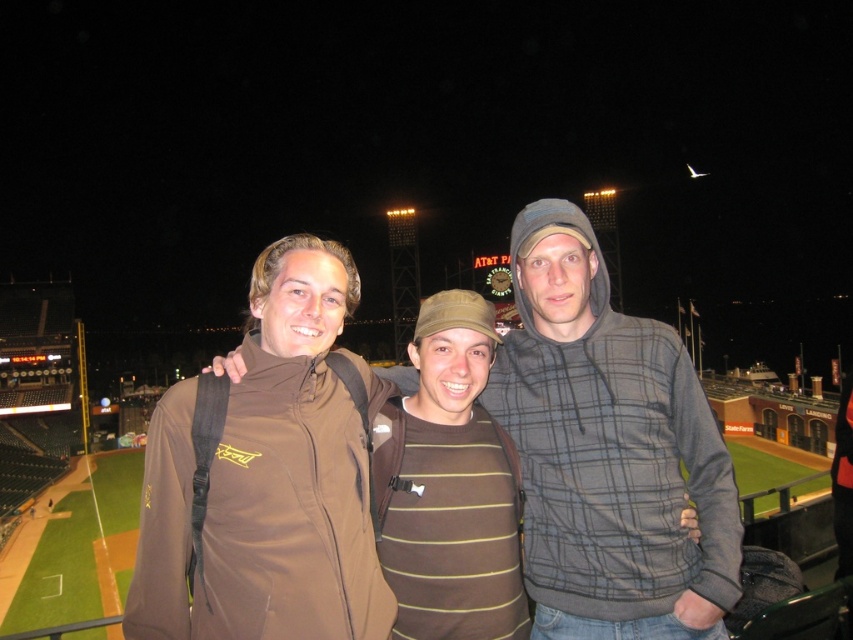
Question: Can you confirm if brown fabric jacket at center is bigger than gray plaid hoodie at center?

Choices:
 (A) yes
 (B) no

Answer: (A)

Question: Is brown fabric jacket at center smaller than gray plaid hoodie at center?

Choices:
 (A) yes
 (B) no

Answer: (B)

Question: Does gray plaid hoodie at center appear on the right side of brown softshell jacket at center?

Choices:
 (A) no
 (B) yes

Answer: (B)

Question: Which point is farther to the camera?

Choices:
 (A) brown softshell jacket at center
 (B) brown fabric jacket at center

Answer: (B)

Question: Which object is the closest to the brown fabric jacket at center?

Choices:
 (A) brown softshell jacket at center
 (B) gray plaid hoodie at center

Answer: (B)

Question: Which of the following is the closest to the observer?

Choices:
 (A) (669, 353)
 (B) (535, 403)

Answer: (A)